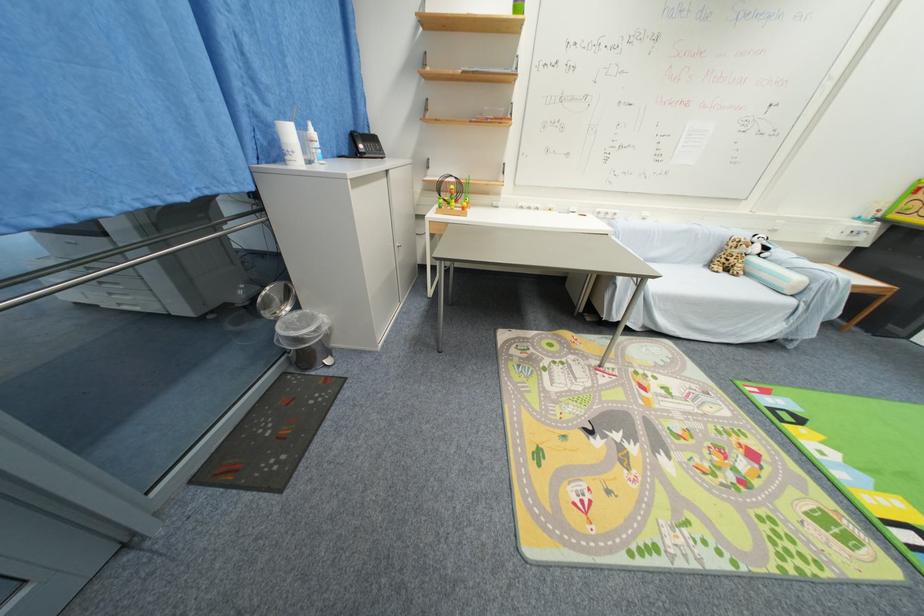
The image size is (924, 616). I want to click on white pump bottle, so click(x=313, y=143).